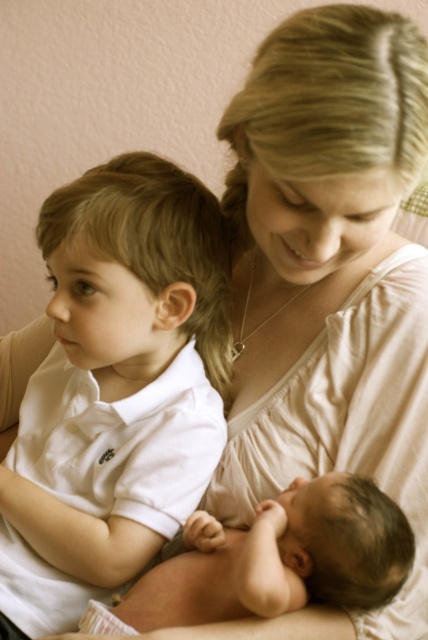
You are a photographer setting up a photo shoot. You have a white cotton shirt at left and a smooth skin baby at center. You need to place a small accessory between them. Based on their widths, which object should the accessory be placed closer to to ensure it fits within the space?

The white cotton shirt at left has a smaller width compared to the smooth skin baby at center. Therefore, the accessory should be placed closer to the white cotton shirt at left to ensure it fits within the available space.

You are a photographer trying to capture a closeup of the smooth skin baby at center without the white cotton shirt at left blocking the view. Can you move closer to the baby to avoid the shirt blocking the shot?

The white cotton shirt at left is further to the viewer than the smooth skin baby at center, so moving closer to the baby would bring the shirt even closer, making it more likely to block the view. You should move away from the shirt to get a clear shot of the smooth skin baby at center.

What object is located at the coordinates point (115, 387)?

The point (115, 387) marks the white cotton shirt at left.